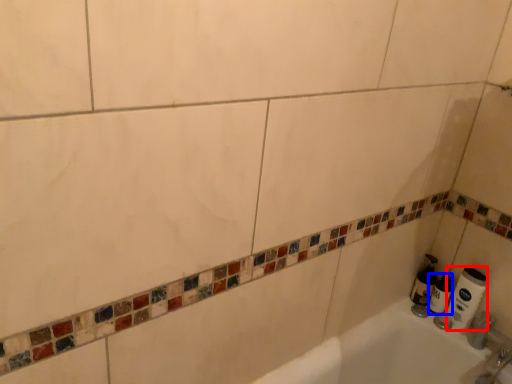
Question: Which object appears farthest to the camera in this image, toilet paper (highlighted by a red box) or toilet paper (highlighted by a blue box)?

Choices:
 (A) toilet paper
 (B) toilet paper

Answer: (B)